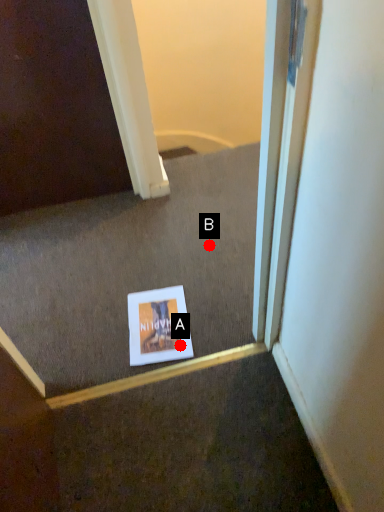
Question: Two points are circled on the image, labeled by A and B beside each circle. Which point is closer to the camera?

Choices:
 (A) A is closer
 (B) B is closer

Answer: (A)